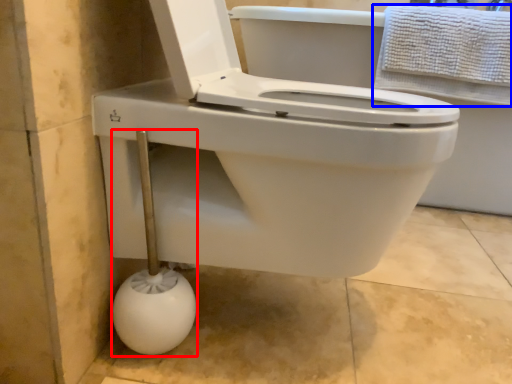
Question: Which point is further to the camera, shower (highlighted by a red box) or towel (highlighted by a blue box)?

Choices:
 (A) shower
 (B) towel

Answer: (B)